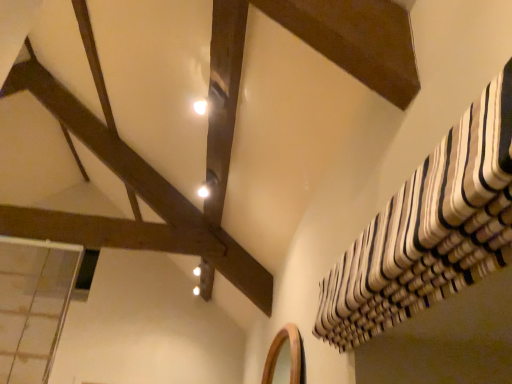
Identify the location of white striped fabric at upper right. (430, 229).

What is the approximate height of white striped fabric at upper right?

It is 10.72 inches.

Describe the element at coordinates (430, 229) in the screenshot. The width and height of the screenshot is (512, 384). I see `white striped fabric at upper right` at that location.

Identify the location of white striped fabric at upper right. This screenshot has height=384, width=512. (430, 229).